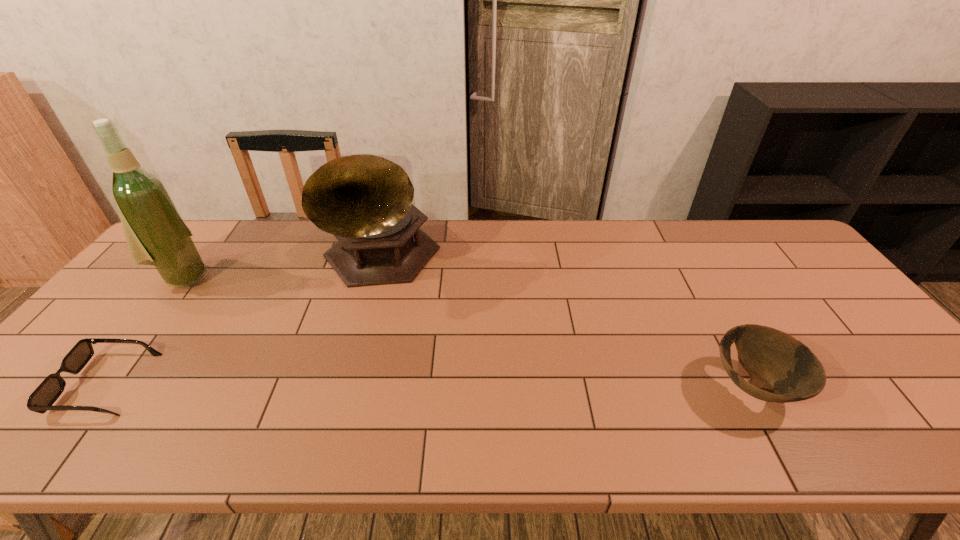
Identify the location of sunglasses. (44, 396).

The width and height of the screenshot is (960, 540). What are the coordinates of `the second shortest object` in the screenshot? It's located at (776, 362).

This screenshot has height=540, width=960. What are the coordinates of `the rightmost object` in the screenshot? It's located at (776, 362).

Locate an element on the screen. Image resolution: width=960 pixels, height=540 pixels. wine bottle is located at coordinates (156, 235).

What are the coordinates of `the third object from left to right` in the screenshot? It's located at (365, 201).

Locate an element on the screen. The image size is (960, 540). the third shortest object is located at coordinates (365, 201).

You are a GUI agent. You are given a task and a screenshot of the screen. Output one action in this format:
    pyautogui.click(x=<x>, y=<y>)
    Task: Click on the free spot located on the back of the bowl
    
    Given the screenshot: What is the action you would take?
    pyautogui.click(x=689, y=270)

Image resolution: width=960 pixels, height=540 pixels. Identify the location of vacant space located 0.170m on the front-facing side of the wine bottle. (234, 309).

Where is `vacant space located 0.330m on the front-facing side of the wine bottle`? Image resolution: width=960 pixels, height=540 pixels. vacant space located 0.330m on the front-facing side of the wine bottle is located at coordinates (271, 334).

Identify the location of vacant region located on the front-facing side of the wine bottle. The width and height of the screenshot is (960, 540). (220, 300).